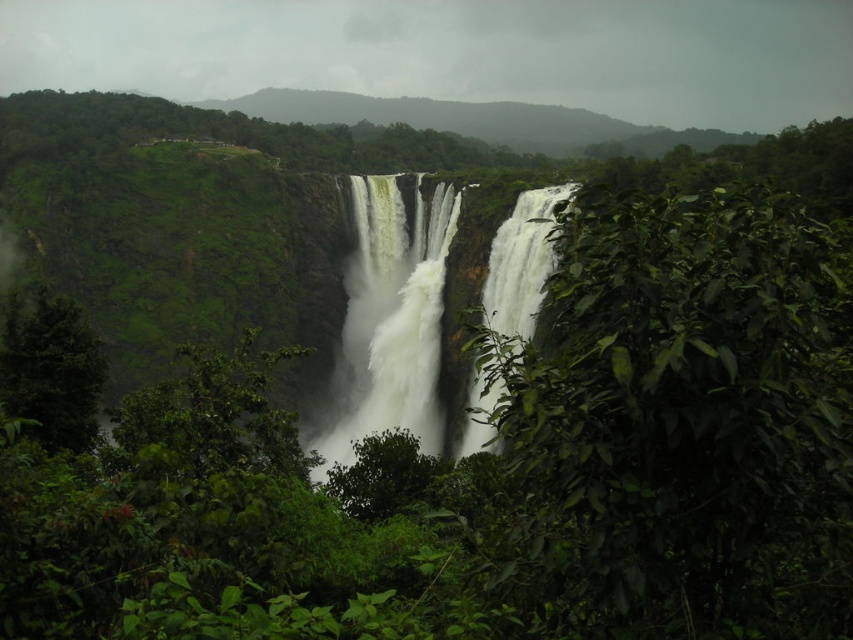
Who is taller, green leafy bush at right or white frothy water at center?

white frothy water at center

What do you see at coordinates (682, 420) in the screenshot? I see `green leafy bush at right` at bounding box center [682, 420].

This screenshot has height=640, width=853. In order to click on green leafy bush at right in this screenshot , I will do `click(682, 420)`.

Is green leafy tree at left smaller than white frothy water at center?

Yes, green leafy tree at left is smaller than white frothy water at center.

Who is positioned more to the left, green leafy tree at left or white frothy water at center?

Positioned to the left is green leafy tree at left.

Is point (39, 394) closer to camera compared to point (502, 314)?

Yes, it is.

You are a GUI agent. You are given a task and a screenshot of the screen. Output one action in this format:
    pyautogui.click(x=<x>, y=<y>)
    Task: Click on the green leafy tree at left
    The image size is (853, 640).
    Given the screenshot: What is the action you would take?
    pyautogui.click(x=51, y=369)

Does green leafy bush at right have a greater width compared to white foamy waterfall at center?

Yes.

The image size is (853, 640). In order to click on green leafy bush at right in this screenshot , I will do `click(682, 420)`.

Which is in front, point (628, 241) or point (405, 323)?

Point (628, 241)

Identify the location of green leafy bush at right. (682, 420).